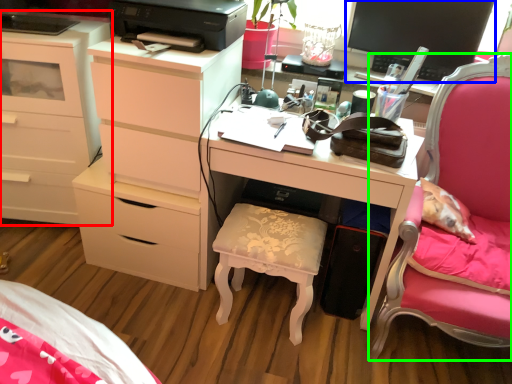
Question: Based on their relative distances, which object is nearer to chest of drawers (highlighted by a red box)? Choose from computer monitor (highlighted by a blue box) and furniture (highlighted by a green box).

Choices:
 (A) computer monitor
 (B) furniture

Answer: (A)